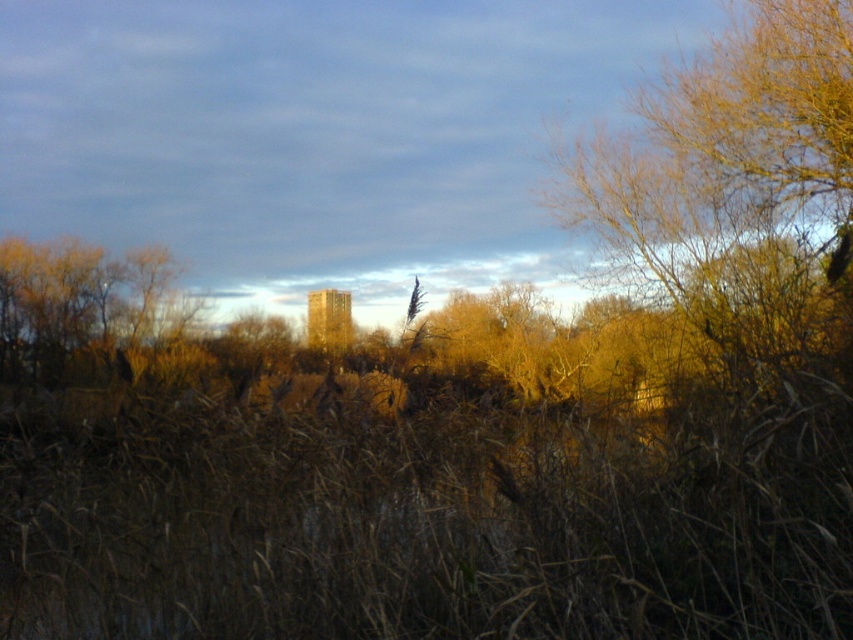
You are standing in the middle of the scene and want to step onto the brown dry grass at center. Based on its position, in which direction should you move to reach it?

The brown dry grass at center is located at point (440, 528), so you should move forward to reach it since it is in the center of the scene.